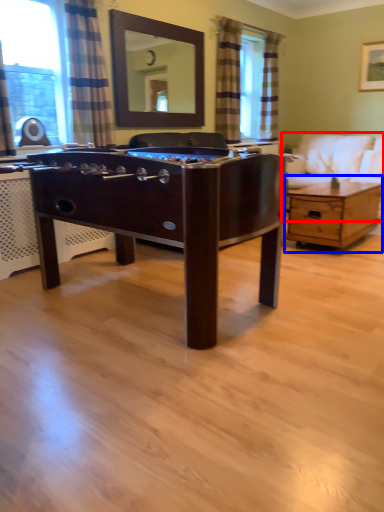
Question: Among these objects, which one is nearest to the camera, studio couch (highlighted by a red box) or coffee table (highlighted by a blue box)?

Choices:
 (A) studio couch
 (B) coffee table

Answer: (B)